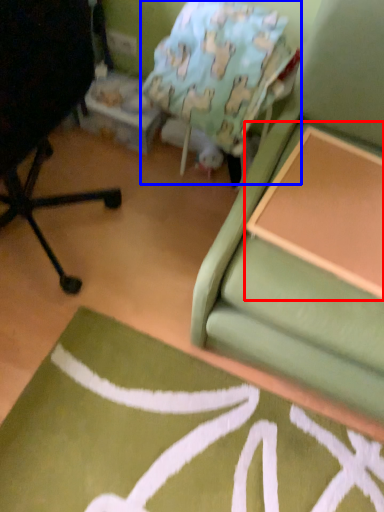
Question: Which point is closer to the camera, table (highlighted by a red box) or bean bag chair (highlighted by a blue box)?

Choices:
 (A) table
 (B) bean bag chair

Answer: (A)